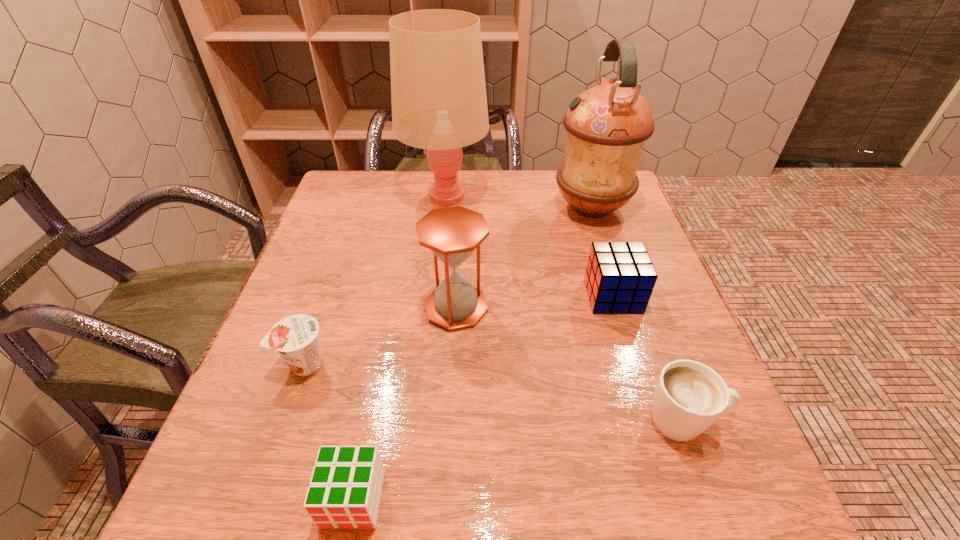
Image resolution: width=960 pixels, height=540 pixels. I want to click on vacant area located 0.310m on the front of the lampshade, so click(x=433, y=309).

I want to click on vacant area situated on the front of the oil lamp, so click(622, 302).

The height and width of the screenshot is (540, 960). In order to click on vacant point located on the front of the hourglass in this screenshot , I will do `click(446, 482)`.

You are a GUI agent. You are given a task and a screenshot of the screen. Output one action in this format:
    pyautogui.click(x=<x>, y=<y>)
    Task: Click on the vacant space located on the front of the farther cube
    
    Given the screenshot: What is the action you would take?
    pyautogui.click(x=625, y=334)

This screenshot has width=960, height=540. In order to click on blank area located on the back of the leftmost object in this screenshot , I will do `click(354, 222)`.

I want to click on lampshade at the far edge, so click(x=438, y=92).

I want to click on oil lamp located at the far edge, so click(607, 125).

This screenshot has width=960, height=540. I want to click on object that is positioned at the near edge, so click(345, 490).

Where is `object that is at the left edge`? This screenshot has height=540, width=960. object that is at the left edge is located at coordinates (295, 337).

Locate an element on the screen. This screenshot has width=960, height=540. oil lamp that is at the right edge is located at coordinates (607, 125).